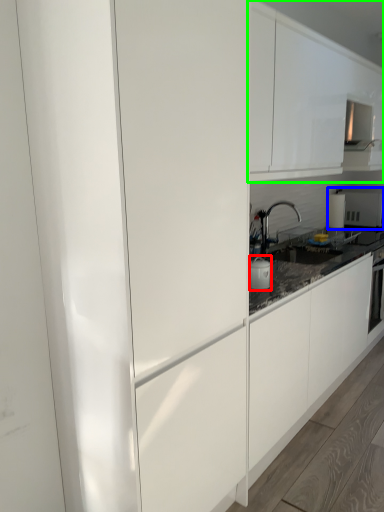
Question: Which is farther away from appliance (highlighted by a red box)? appliance (highlighted by a blue box) or cabinetry (highlighted by a green box)?

Choices:
 (A) appliance
 (B) cabinetry

Answer: (A)